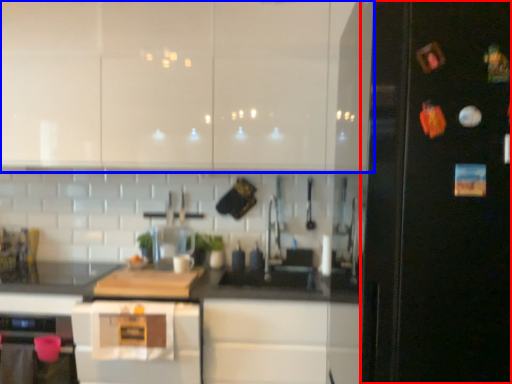
Question: Among these objects, which one is nearest to the camera, fridge (highlighted by a red box) or cabinetry (highlighted by a blue box)?

Choices:
 (A) fridge
 (B) cabinetry

Answer: (A)